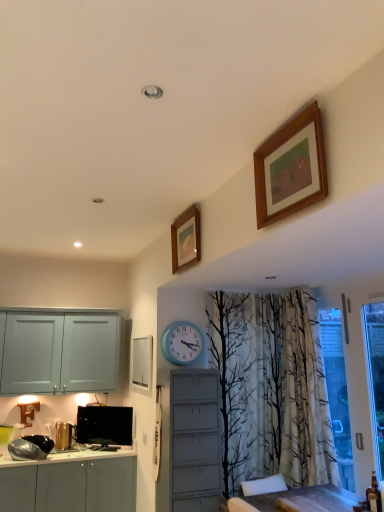
Question: Is black glossy television at lower left to the left of wooden picture frame at upper center, the 2th picture frame when ordered from back to front, from the viewer's perspective?

Choices:
 (A) no
 (B) yes

Answer: (B)

Question: Can you confirm if black glossy television at lower left is smaller than wooden picture frame at upper center, acting as the second picture frame starting from the bottom?

Choices:
 (A) no
 (B) yes

Answer: (B)

Question: Is black glossy television at lower left outside wooden picture frame at upper center, which is counted as the second picture frame, starting from the top?

Choices:
 (A) no
 (B) yes

Answer: (B)

Question: Could you tell me if black glossy television at lower left is facing wooden picture frame at upper center, the 2th picture frame when ordered from back to front?

Choices:
 (A) yes
 (B) no

Answer: (B)

Question: Is black glossy television at lower left not close to wooden picture frame at upper center, the 2th picture frame when ordered from back to front?

Choices:
 (A) no
 (B) yes

Answer: (B)

Question: Considering the relative positions of blue plastic clock at center and white matte picture frame at center, positioned as the third picture frame in right-to-left order, in the image provided, is blue plastic clock at center to the left or to the right of white matte picture frame at center, positioned as the third picture frame in right-to-left order,?

Choices:
 (A) left
 (B) right

Answer: (B)

Question: Is point (195, 332) positioned closer to the camera than point (142, 360)?

Choices:
 (A) closer
 (B) farther

Answer: (A)

Question: In terms of size, does blue plastic clock at center appear bigger or smaller than white matte picture frame at center, positioned as the 3th picture frame in top-to-bottom order?

Choices:
 (A) small
 (B) big

Answer: (A)

Question: Is blue plastic clock at center situated inside white matte picture frame at center, which is the third picture frame in front-to-back order, or outside?

Choices:
 (A) inside
 (B) outside

Answer: (B)

Question: Is black glossy television at lower left wider or thinner than wooden picture frame at upper center, which is counted as the second picture frame, starting from the top?

Choices:
 (A) wide
 (B) thin

Answer: (B)

Question: From a real-world perspective, is black glossy television at lower left physically located above or below wooden picture frame at upper center, the second picture frame positioned from the left?

Choices:
 (A) below
 (B) above

Answer: (A)

Question: In terms of height, does black glossy television at lower left look taller or shorter compared to wooden picture frame at upper center, which appears as the second picture frame when viewed from the right?

Choices:
 (A) tall
 (B) short

Answer: (B)

Question: Is black glossy television at lower left inside the boundaries of wooden picture frame at upper center, the 2th picture frame when ordered from back to front, or outside?

Choices:
 (A) inside
 (B) outside

Answer: (B)

Question: Is blue plastic clock at center inside the boundaries of wooden-framed painting at upper right, arranged as the 1th picture frame when viewed from the right, or outside?

Choices:
 (A) inside
 (B) outside

Answer: (B)

Question: Is blue plastic clock at center in front of or behind wooden-framed painting at upper right, arranged as the 1th picture frame when viewed from the right, in the image?

Choices:
 (A) front
 (B) behind

Answer: (B)